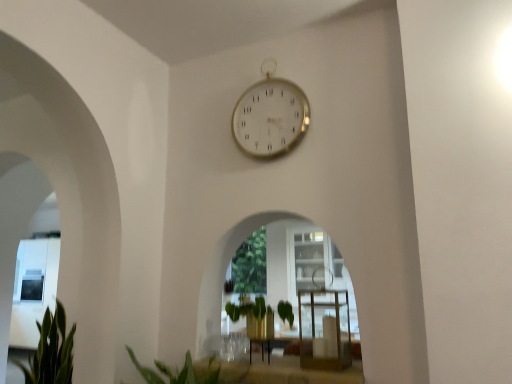
Question: From a real-world perspective, relative to green leafy plant at lower left, is green leafy plant at center vertically above or below?

Choices:
 (A) below
 (B) above

Answer: (B)

Question: Visually, is green leafy plant at center positioned to the left or to the right of green leafy plant at lower left?

Choices:
 (A) right
 (B) left

Answer: (A)

Question: Which object is the farthest from the gold metallic clock at upper center?

Choices:
 (A) clear glass table at center
 (B) green leafy plant at lower left
 (C) green leafy plant at center

Answer: (B)

Question: Considering the real-world distances, which object is farthest from the green leafy plant at lower left?

Choices:
 (A) gold metallic clock at upper center
 (B) clear glass table at center
 (C) green leafy plant at center

Answer: (A)